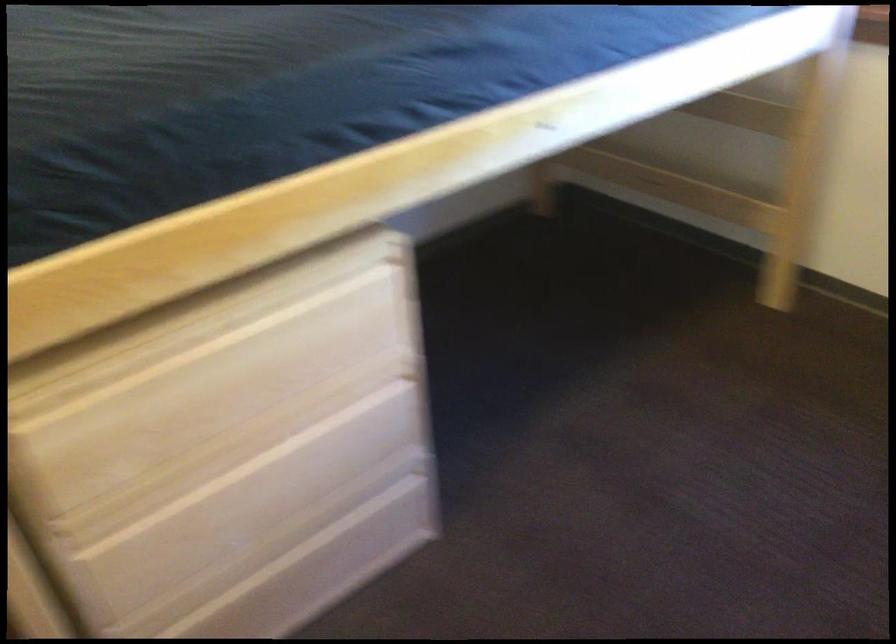
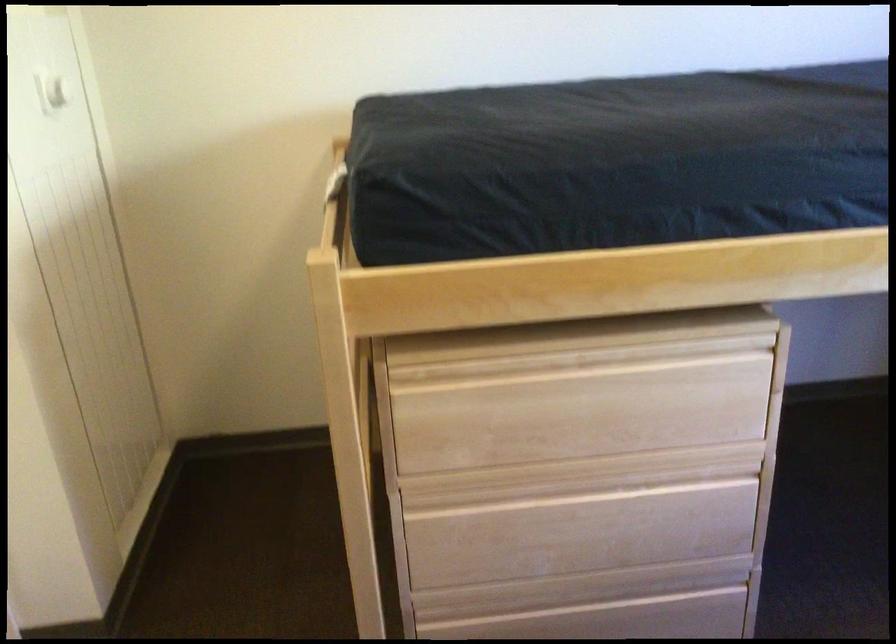
Find the pixel in the second image that matches [316,554] in the first image.

(615, 619)